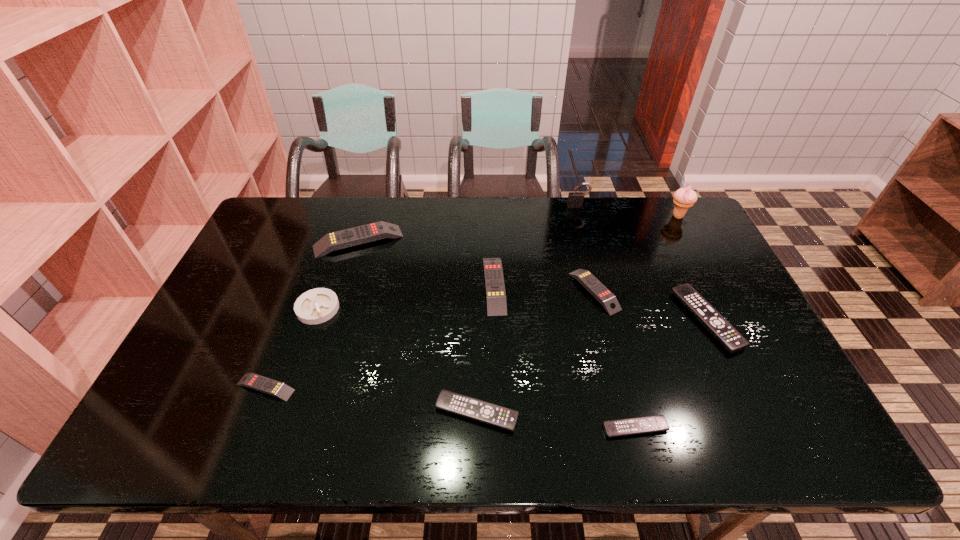
Identify which yellow remote control is the closest to the nearest yellow remote control. Please provide its 2D coordinates. Your answer should be formatted as a tuple, i.e. [(x, y)], where the tuple contains the x and y coordinates of a point satisfying the conditions above.

[(354, 236)]

Locate which yellow remote control is the second closest to the second yellow remote control from right to left. Please provide its 2D coordinates. Your answer should be formatted as a tuple, i.e. [(x, y)], where the tuple contains the x and y coordinates of a point satisfying the conditions above.

[(354, 236)]

Select which black remote control is the second closest to the rightmost remote control. Please provide its 2D coordinates. Your answer should be formatted as a tuple, i.e. [(x, y)], where the tuple contains the x and y coordinates of a point satisfying the conditions above.

[(475, 409)]

The image size is (960, 540). Identify the location of the closest black remote control to the leftmost black remote control. (649, 424).

This screenshot has width=960, height=540. I want to click on vacant region that satisfies the following two spatial constraints: 1. on the front side of the gray ashtray; 2. on the left side of the second black remote control from left to right, so click(276, 428).